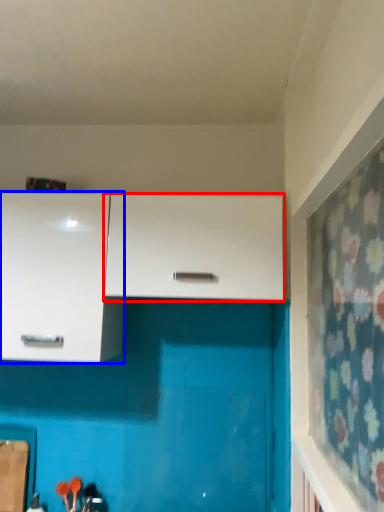
Question: Which object is closer to the camera taking this photo, cabinetry (highlighted by a red box) or cabinetry (highlighted by a blue box)?

Choices:
 (A) cabinetry
 (B) cabinetry

Answer: (A)